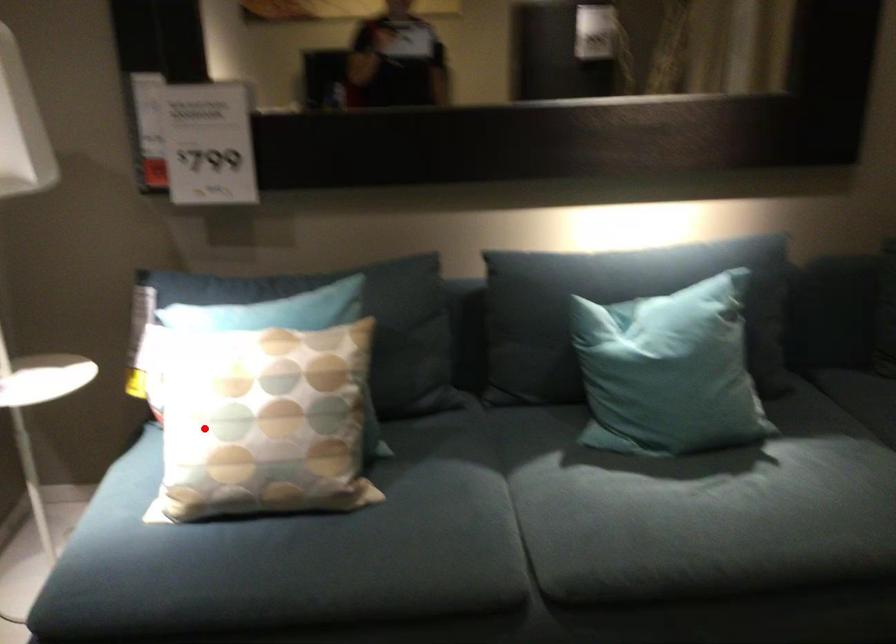
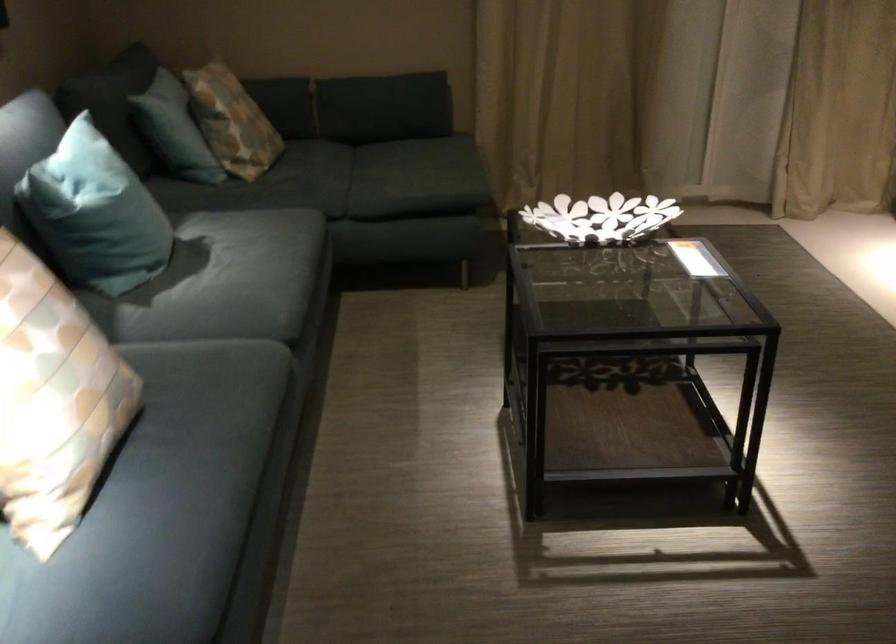
Find the pixel in the second image that matches the highlighted location in the first image.

(53, 401)